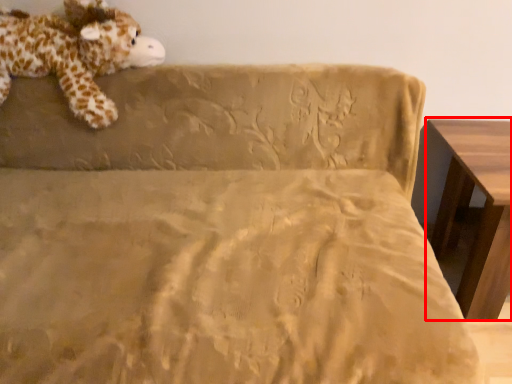
Question: From the image's perspective, where is table (annotated by the red box) located relative to animal?

Choices:
 (A) below
 (B) above

Answer: (A)